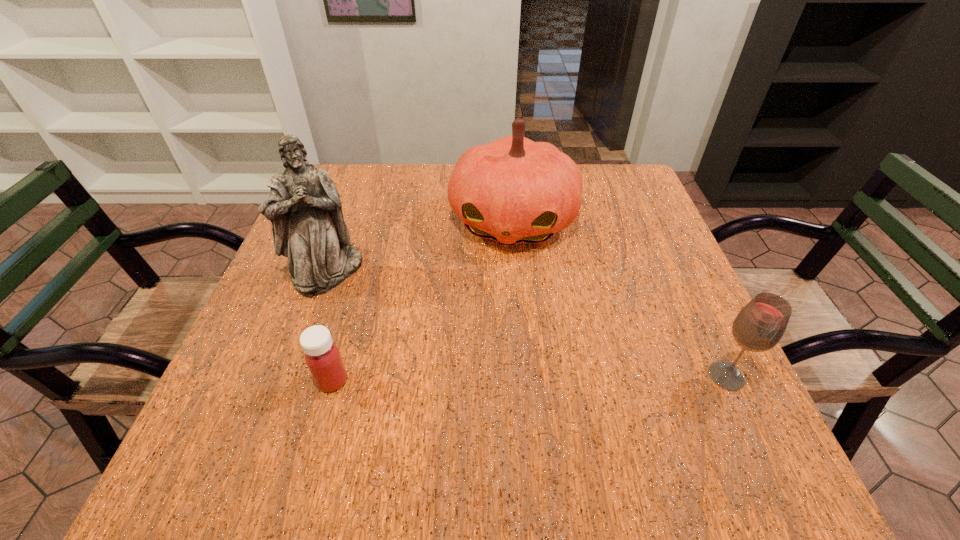
Identify which object is located as the nearest to the shortest object. Please provide its 2D coordinates. Your answer should be formatted as a tuple, i.e. [(x, y)], where the tuple contains the x and y coordinates of a point satisfying the conditions above.

[(304, 206)]

Select which object is the third closest to the shortest object. Please provide its 2D coordinates. Your answer should be formatted as a tuple, i.e. [(x, y)], where the tuple contains the x and y coordinates of a point satisfying the conditions above.

[(759, 326)]

In order to click on free space that satisfies the following two spatial constraints: 1. on the front side of the shortest object; 2. on the right side of the figurine in this screenshot , I will do `click(288, 381)`.